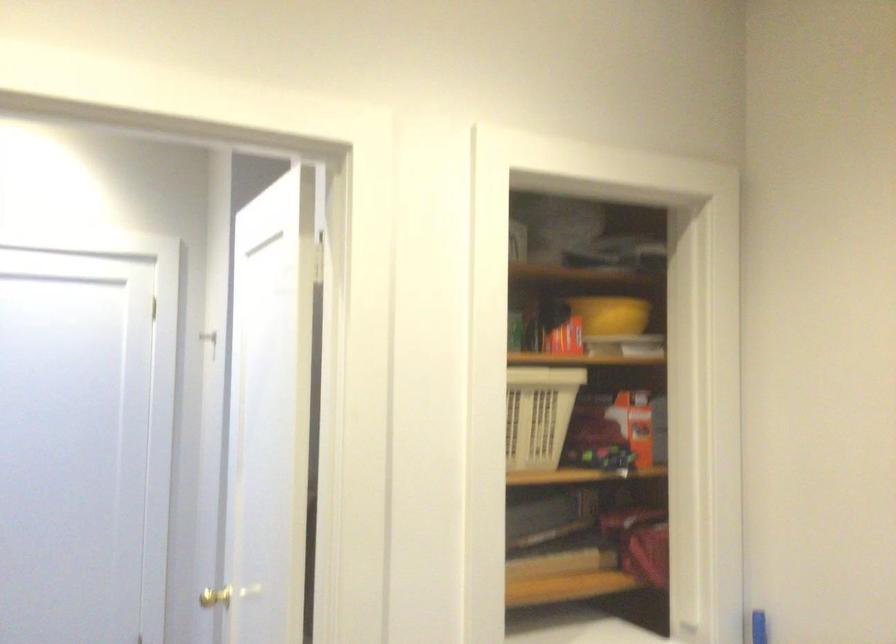
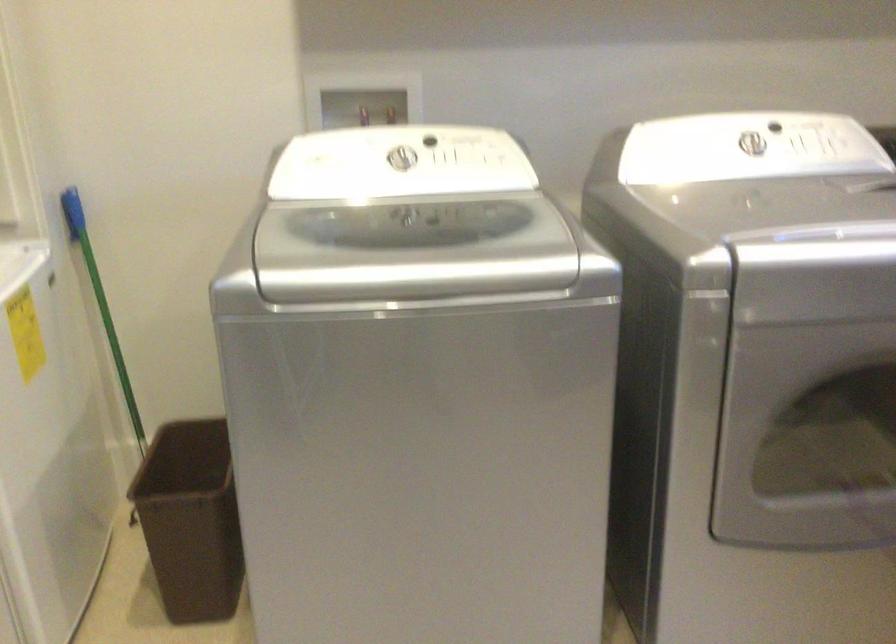
First-person continuous shooting, in which direction is the camera rotating?

The camera rotated toward right-down.